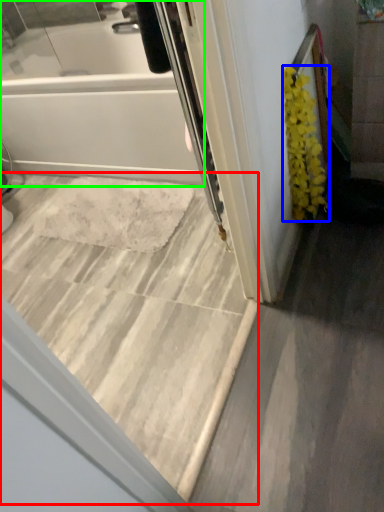
Question: Considering the real-world distances, which object is closest to stairwell (highlighted by a red box)? flower (highlighted by a blue box) or bathtub (highlighted by a green box).

Choices:
 (A) flower
 (B) bathtub

Answer: (B)